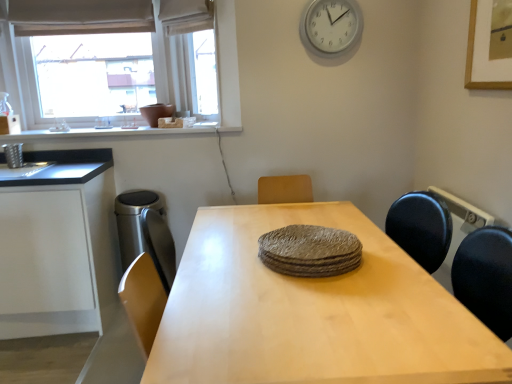
The height and width of the screenshot is (384, 512). In order to click on free point in front of textured gray plates at center in this screenshot , I will do `click(336, 306)`.